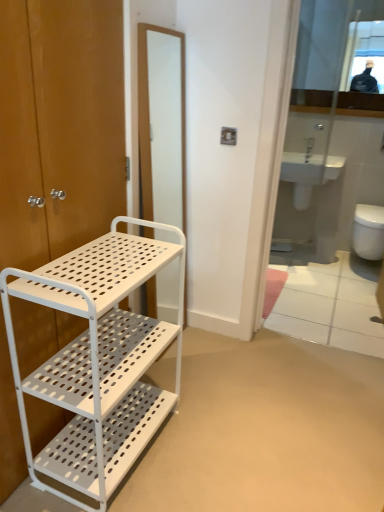
Question: Considering the relative sizes of white ceramic sink at center and white perforated metal shelf at left in the image provided, is white ceramic sink at center shorter than white perforated metal shelf at left?

Choices:
 (A) yes
 (B) no

Answer: (A)

Question: Is white ceramic sink at center located outside white perforated metal shelf at left?

Choices:
 (A) yes
 (B) no

Answer: (A)

Question: Could you tell me if white ceramic sink at center is facing white perforated metal shelf at left?

Choices:
 (A) yes
 (B) no

Answer: (A)

Question: Is white ceramic sink at center at the right side of white perforated metal shelf at left?

Choices:
 (A) yes
 (B) no

Answer: (A)

Question: Is white ceramic sink at center next to white perforated metal shelf at left and touching it?

Choices:
 (A) no
 (B) yes

Answer: (A)

Question: Is matte wood door at left taller or shorter than white perforated metal shelf at left?

Choices:
 (A) short
 (B) tall

Answer: (B)

Question: Looking at their shapes, would you say matte wood door at left is wider or thinner than white perforated metal shelf at left?

Choices:
 (A) thin
 (B) wide

Answer: (A)

Question: From the image's perspective, relative to white perforated metal shelf at left, is matte wood door at left above or below?

Choices:
 (A) above
 (B) below

Answer: (A)

Question: Considering the positions of point (6, 446) and point (67, 433), is point (6, 446) closer or farther from the camera than point (67, 433)?

Choices:
 (A) farther
 (B) closer

Answer: (B)

Question: Considering the positions of white glossy toilet at right and white perforated metal shelf at left in the image, is white glossy toilet at right bigger or smaller than white perforated metal shelf at left?

Choices:
 (A) big
 (B) small

Answer: (B)

Question: Would you say white glossy toilet at right is inside or outside white perforated metal shelf at left?

Choices:
 (A) outside
 (B) inside

Answer: (A)

Question: From the image's perspective, is white glossy toilet at right above or below white perforated metal shelf at left?

Choices:
 (A) above
 (B) below

Answer: (A)

Question: Looking at their shapes, would you say white glossy toilet at right is wider or thinner than white perforated metal shelf at left?

Choices:
 (A) wide
 (B) thin

Answer: (A)

Question: In terms of size, does white glossy toilet at right appear bigger or smaller than white matte screen door at center?

Choices:
 (A) small
 (B) big

Answer: (B)

Question: Is point (352, 245) positioned closer to the camera than point (145, 158)?

Choices:
 (A) closer
 (B) farther

Answer: (B)